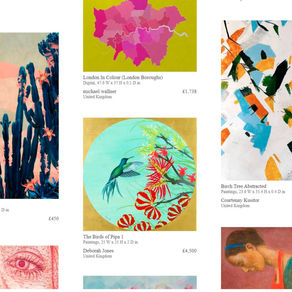
Identify the location of artwork / painting. The height and width of the screenshot is (292, 292). (132, 46).